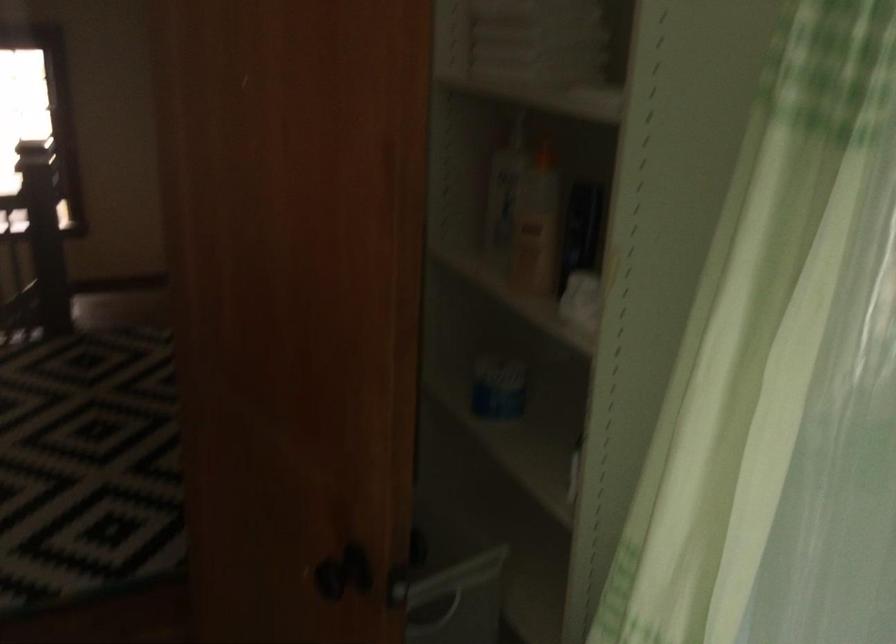
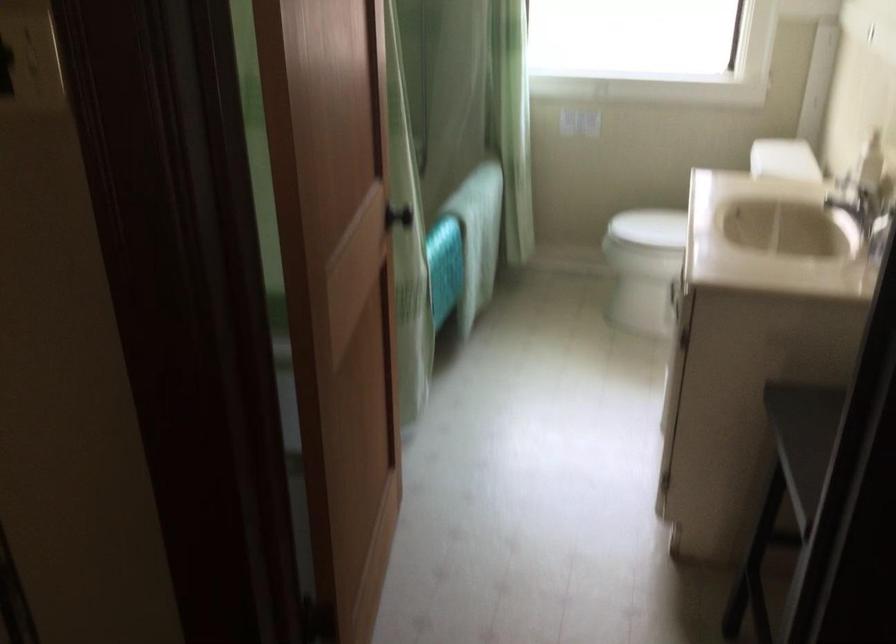
Question: I am providing you with two images of the same scene from different viewpoints. Please identify which objects are invisible in image2.

Choices:
 (A) white toilet lid
 (B) black door handle
 (C) storage bin handle
 (D) blue tool handles

Answer: (C)